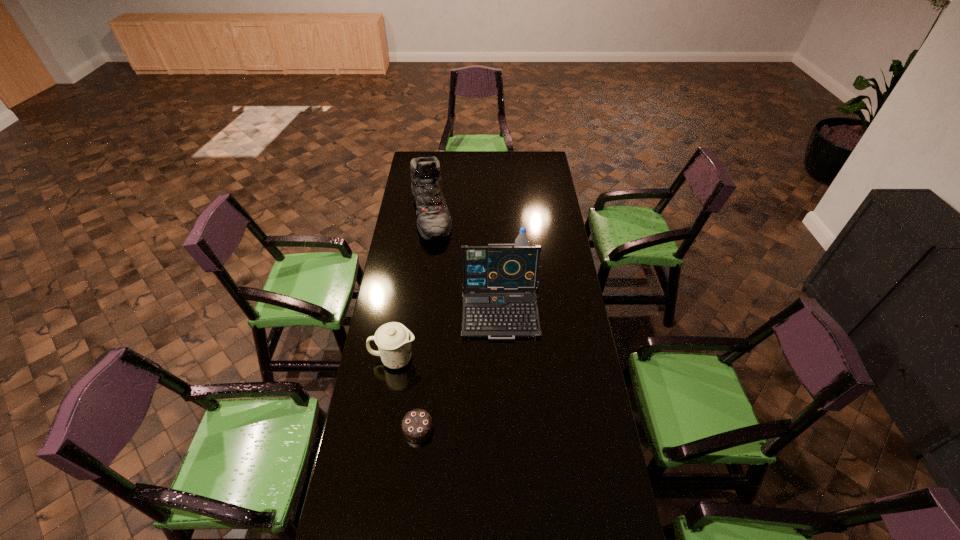
Locate an element on the screen. Image resolution: width=960 pixels, height=540 pixels. free space that is in between the bottle and the fourth farthest object is located at coordinates (458, 307).

The width and height of the screenshot is (960, 540). In order to click on vacant space that is in between the fourth farthest object and the nearest object in this screenshot , I will do `click(406, 394)`.

This screenshot has height=540, width=960. I want to click on vacant space in between the nearest object and the chinaware, so click(x=406, y=394).

This screenshot has width=960, height=540. I want to click on object that is the third closest to the bottle, so click(x=393, y=339).

Where is `object that stands as the third closest to the second farthest object`? object that stands as the third closest to the second farthest object is located at coordinates (393, 339).

Image resolution: width=960 pixels, height=540 pixels. In order to click on blank area in the image that satisfies the following two spatial constraints: 1. on the back side of the second farthest object; 2. on the right side of the shortest object in this screenshot , I will do `click(436, 255)`.